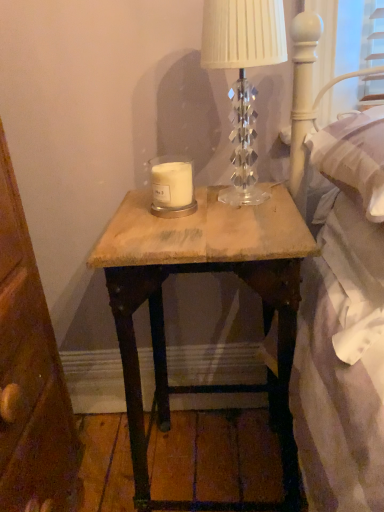
This screenshot has width=384, height=512. Identify the location of free space to the left of clear crystal lamp at upper center. (171, 218).